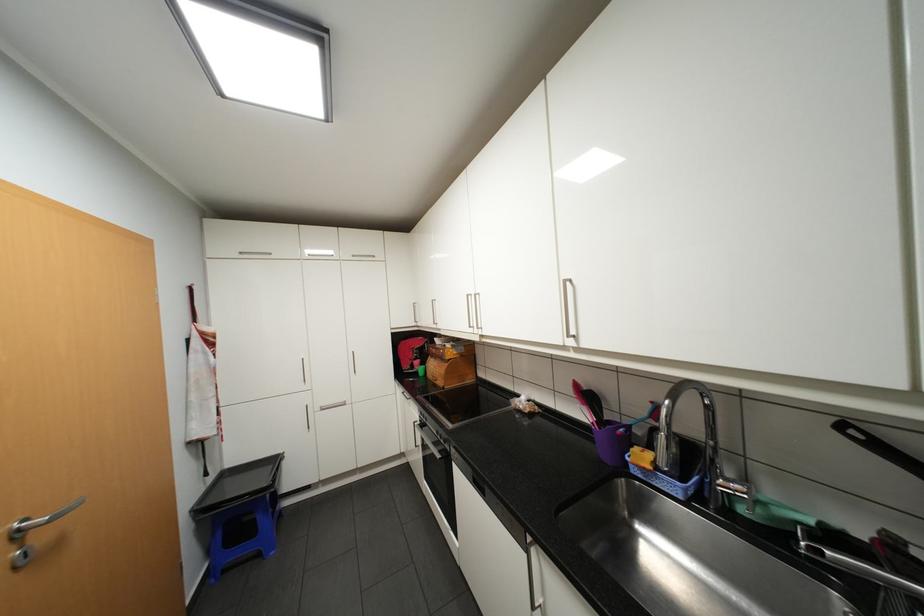
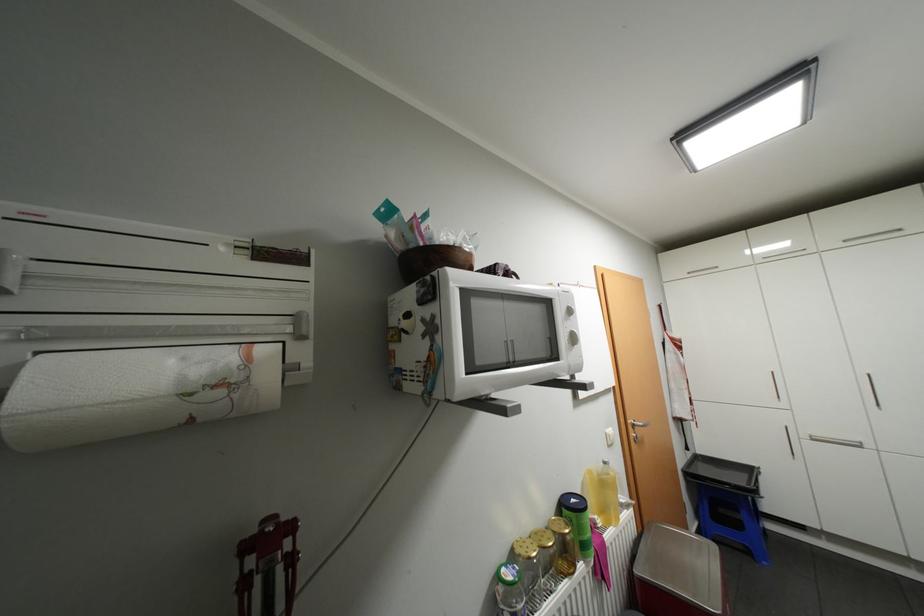
Find the pixel in the second image that matches pixel 266 554 in the first image.

(756, 552)